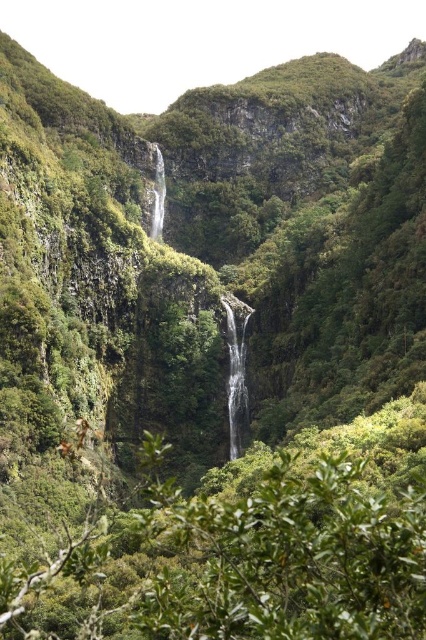
Does white smooth waterfall at center appear on the right side of transparent glass waterfall at center?

Correct, you'll find white smooth waterfall at center to the right of transparent glass waterfall at center.

Is white smooth waterfall at center above transparent glass waterfall at center?

No.

Locate an element on the screen. white smooth waterfall at center is located at coordinates (236, 368).